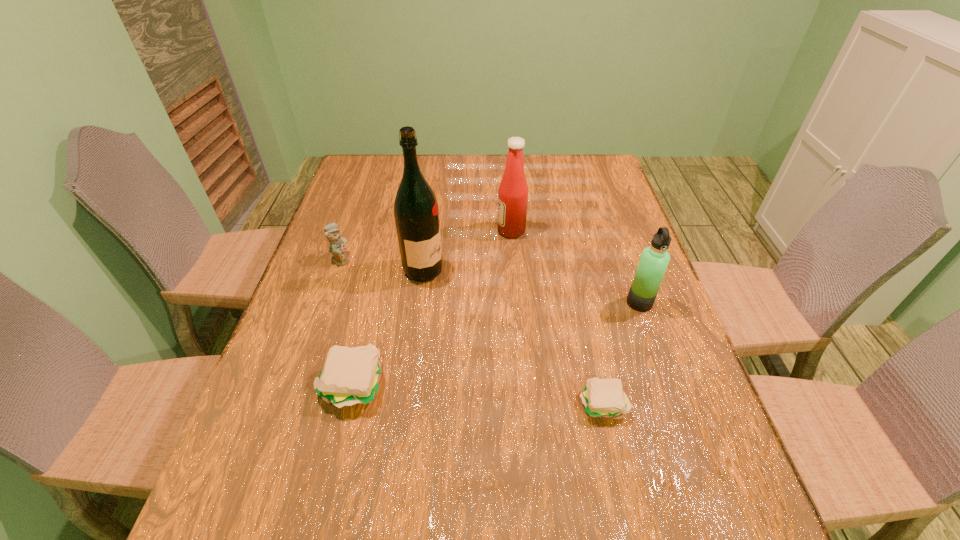
Please point a location where one more patty_(food) can be added evenly. Please provide its 2D coordinates. Your answer should be formatted as a tuple, i.e. [(x, y)], where the tuple contains the x and y coordinates of a point satisfying the conditions above.

[(475, 394)]